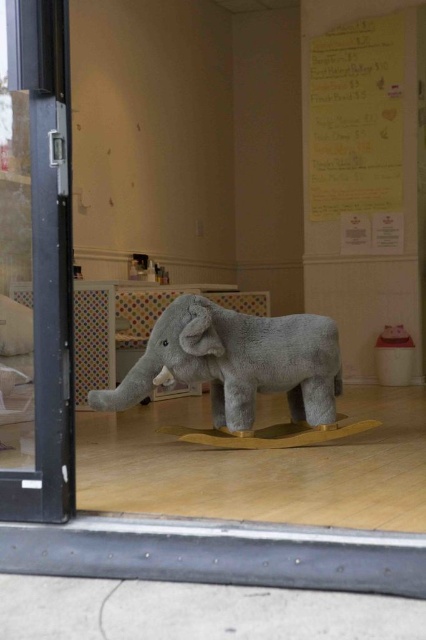
Between yellow paper at upper center and gray plush elephant at center, which one has less height?

gray plush elephant at center is shorter.

Is yellow paper at upper center thinner than gray plush elephant at center?

Yes.

Between point (368, 204) and point (282, 320), which one is positioned behind?

The point (368, 204) is behind.

The width and height of the screenshot is (426, 640). I want to click on yellow paper at upper center, so click(x=354, y=136).

Who is taller, transparent glass door at left or yellow paper at upper center?

yellow paper at upper center

Does transparent glass door at left come in front of yellow paper at upper center?

Yes, it is in front of yellow paper at upper center.

You are a GUI agent. You are given a task and a screenshot of the screen. Output one action in this format:
    pyautogui.click(x=<x>, y=<y>)
    Task: Click on the transparent glass door at left
    
    Given the screenshot: What is the action you would take?
    pyautogui.click(x=36, y=262)

Image resolution: width=426 pixels, height=640 pixels. I want to click on transparent glass door at left, so tap(36, 262).

What are the coordinates of `transparent glass door at left` in the screenshot? It's located at (36, 262).

Is transparent glass door at left wider than gray plush elephant at center?

No, transparent glass door at left is not wider than gray plush elephant at center.

Which is behind, point (25, 358) or point (255, 330)?

The point (255, 330) is more distant.

In order to click on transparent glass door at left in this screenshot , I will do `click(36, 262)`.